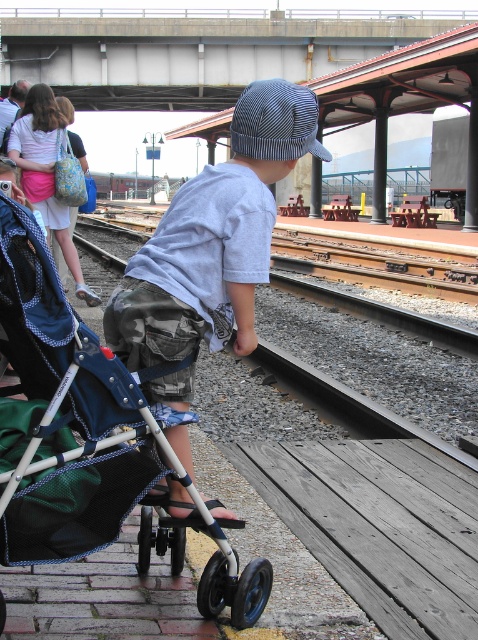
Question: Considering the real-world distances, which object is farthest from the blue fabric stroller at lower left?

Choices:
 (A) brown gravel train track at center
 (B) light blue cotton shirt at center

Answer: (A)

Question: Among these objects, which one is farthest from the camera?

Choices:
 (A) light blue cotton shirt at center
 (B) brown gravel train track at center

Answer: (B)

Question: Is blue fabric stroller at lower left below light blue cotton shirt at center?

Choices:
 (A) yes
 (B) no

Answer: (A)

Question: Is blue fabric stroller at lower left positioned in front of brown gravel train track at center?

Choices:
 (A) yes
 (B) no

Answer: (A)

Question: Can you confirm if light blue cotton shirt at center is positioned to the left of brown gravel train track at center?

Choices:
 (A) yes
 (B) no

Answer: (B)

Question: Which of the following is the farthest from the observer?

Choices:
 (A) (105, 234)
 (B) (77, 502)

Answer: (A)